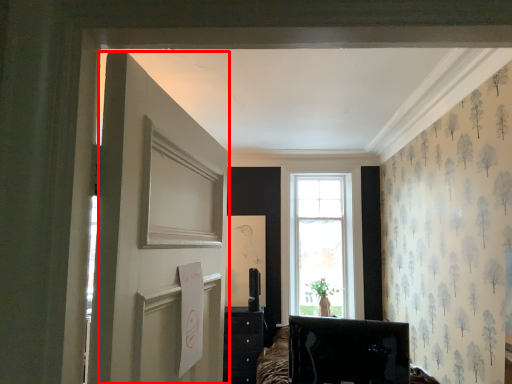
Question: Where is door (annotated by the red box) located in relation to furniture in the image?

Choices:
 (A) right
 (B) left

Answer: (B)